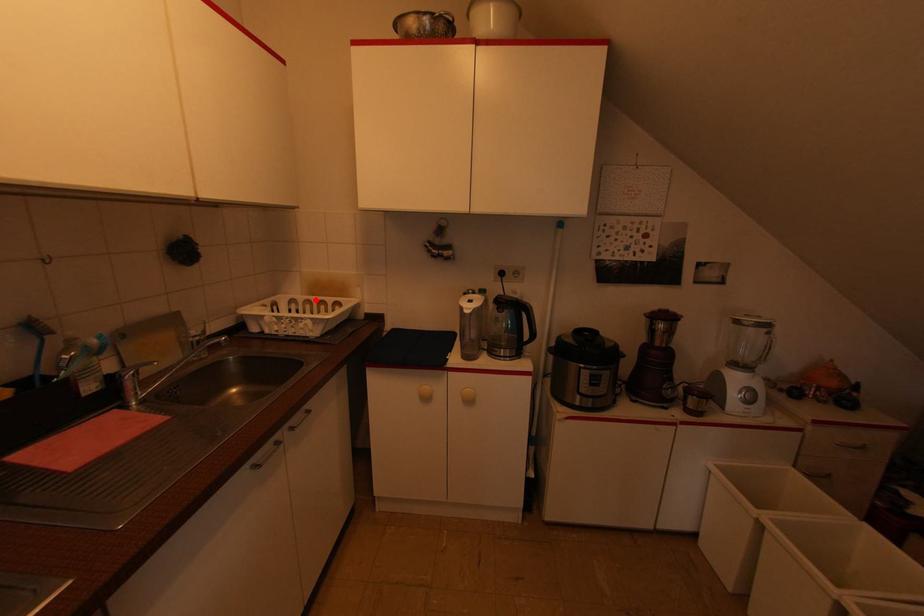
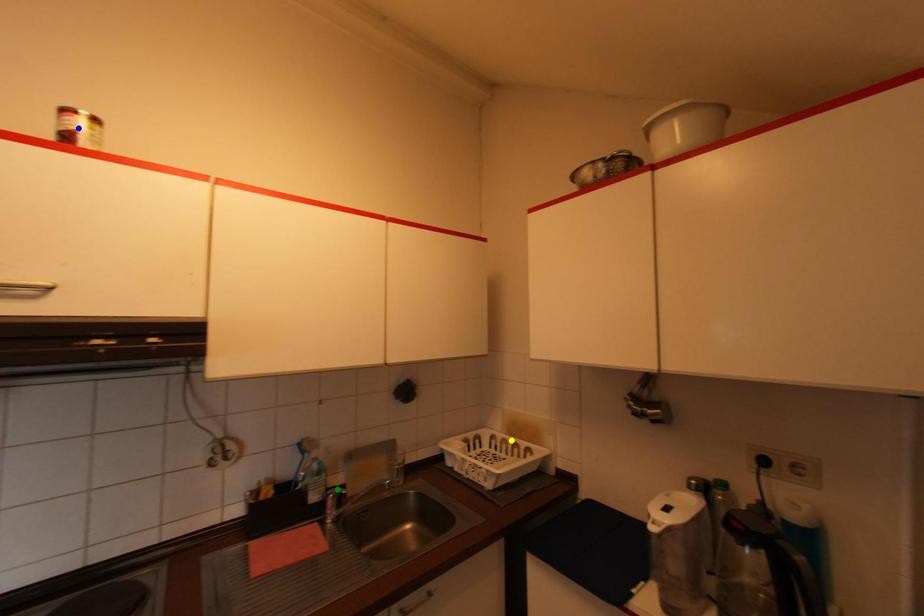
Question: I am providing you with two images of the same scene from different viewpoints. A red point is marked on the first image. You are given multiple points on the second image. Which point in image 2 represents the same 3d spot as the red point in image 1?

Choices:
 (A) blue point
 (B) yellow point
 (C) green point

Answer: (B)